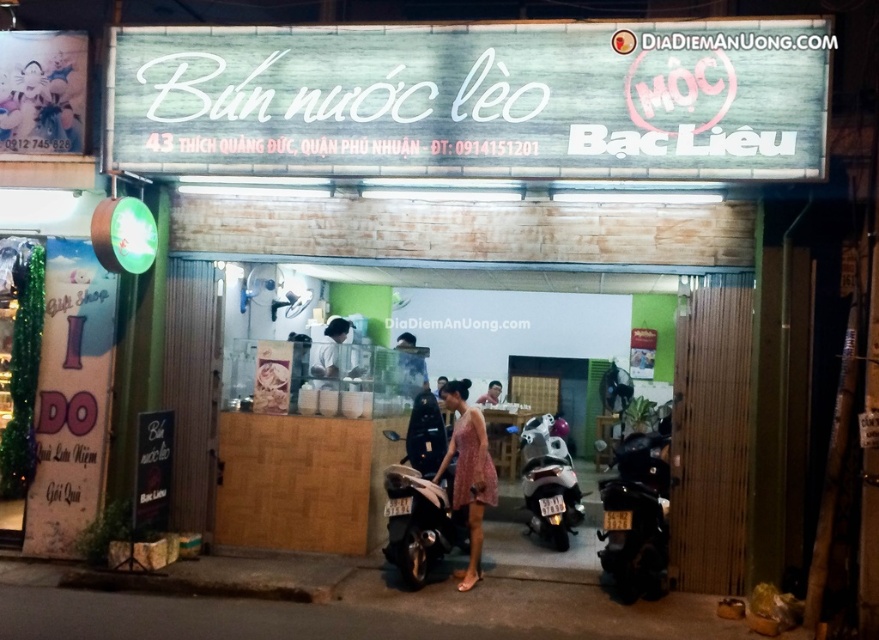
Question: Is white wood sign at upper center wider than black matte motorcycle at center?

Choices:
 (A) no
 (B) yes

Answer: (B)

Question: Is black matte motorcycle at lower right thinner than pink fabric dress at center?

Choices:
 (A) no
 (B) yes

Answer: (A)

Question: Which of the following is the closest to the observer?

Choices:
 (A) [477, 116]
 (B) [636, 540]
 (C) [343, 348]
 (D) [429, 544]

Answer: (A)

Question: Which object is farther from the camera taking this photo?

Choices:
 (A) pink fabric dress at center
 (B) white wood sign at upper center
 (C) black matte motorcycle at lower right
 (D) white glossy cup at center

Answer: (D)

Question: Can you confirm if white wood sign at upper center is positioned above white glossy cup at center?

Choices:
 (A) yes
 (B) no

Answer: (A)

Question: Which is farther from the black matte motorcycle at lower right?

Choices:
 (A) white glossy cup at center
 (B) black matte motorcycle at center

Answer: (A)